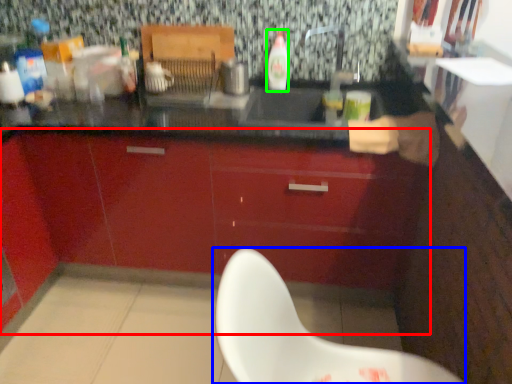
Question: Which is farther away from cabinetry (highlighted by a red box)? chair (highlighted by a blue box) or bottle (highlighted by a green box)?

Choices:
 (A) chair
 (B) bottle

Answer: (A)